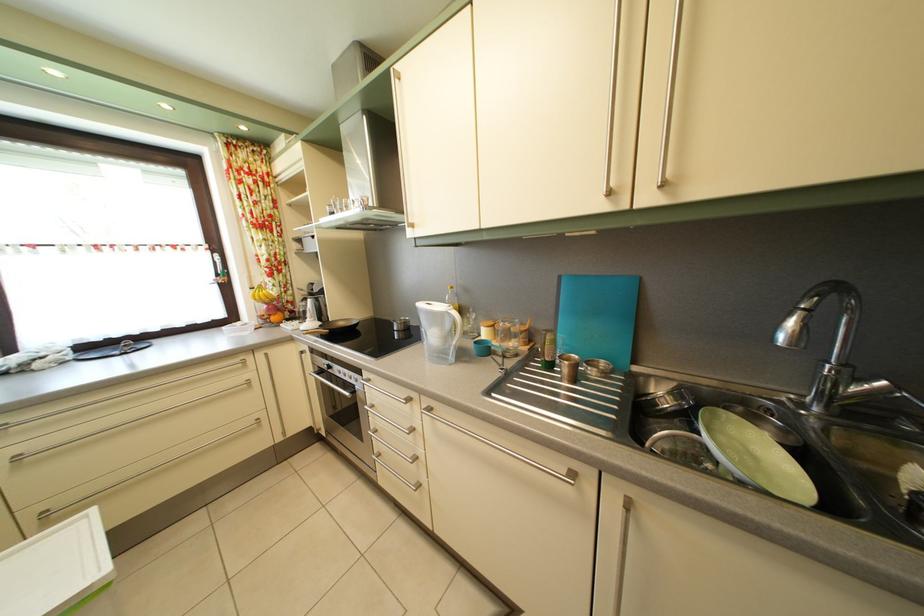
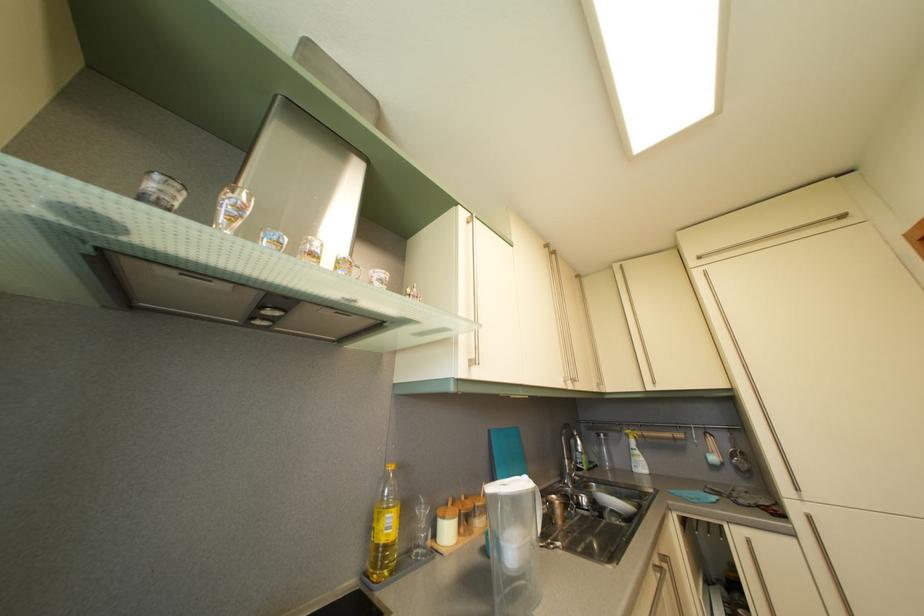
The point at (x=567, y=285) is marked in the first image. Where is the corresponding point in the second image?

(497, 439)